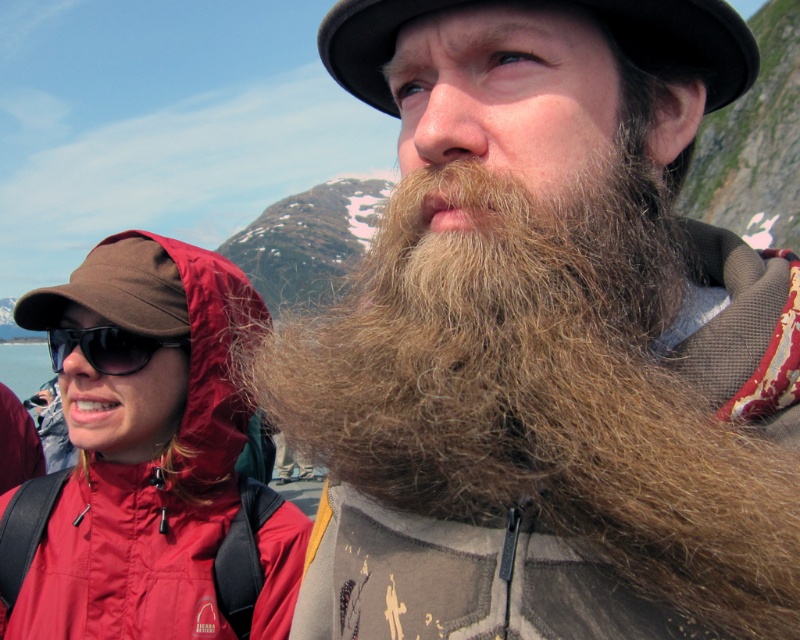
You are standing at the point marked as point (69, 387). You want to reach the other person who is 48.05 meters away. If you walk straight towards them at a speed of 3 meters per second, how many seconds will it take you to reach them?

It will take you 16 seconds to reach the other person because 48.05 meters divided by 3 meters per second equals approximately 16 seconds.

You are a photographer trying to capture both the black felt hat at upper center and the black plastic sunglasses at upper left in a single frame. Since you want to ensure both are visible, which object should you focus on first to account for their sizes?

The black felt hat at upper center is taller than the black plastic sunglasses at upper left, so you should focus on the black felt hat at upper center first to ensure its full height is captured before adjusting for the smaller sunglasses.

You are packing for a cold mountain hike and have both a matte red jacket at left and a black felt hat at upper center. Which item would provide better insulation based on their thickness?

The black felt hat at upper center is thicker than the matte red jacket at left, so it would provide better insulation.